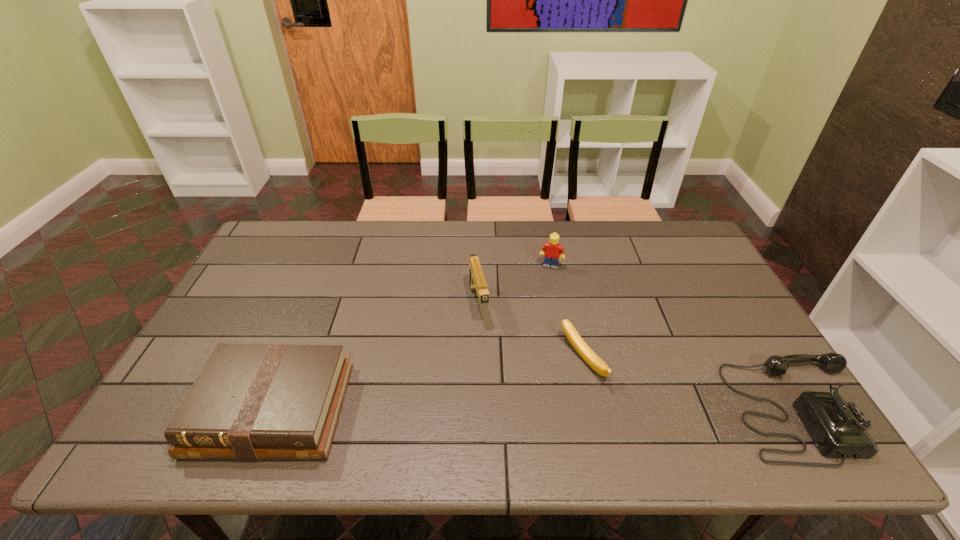
Locate an element on the screen. The width and height of the screenshot is (960, 540). vacant space positioned 0.140m at the barrel of the second farthest object is located at coordinates (491, 366).

Locate an element on the screen. The width and height of the screenshot is (960, 540). vacant point located at the barrel of the second farthest object is located at coordinates (502, 409).

Locate an element on the screen. vacant point located 0.150m at the barrel of the second farthest object is located at coordinates (492, 369).

The height and width of the screenshot is (540, 960). Find the location of `free space located on the front-facing side of the farthest object`. free space located on the front-facing side of the farthest object is located at coordinates (523, 360).

At what (x,y) coordinates should I click in order to perform the action: click on vacant space situated on the front-facing side of the farthest object. Please return your answer as a coordinate pair (x, y). The height and width of the screenshot is (540, 960). Looking at the image, I should click on (526, 352).

The height and width of the screenshot is (540, 960). Identify the location of free location located on the front-facing side of the farthest object. (526, 352).

Identify the location of Bible located at the near edge. Image resolution: width=960 pixels, height=540 pixels. (251, 401).

Locate an element on the screen. telephone at the near edge is located at coordinates (838, 428).

This screenshot has width=960, height=540. In order to click on banana at the near edge in this screenshot , I will do `click(589, 356)`.

Identify the location of object located at the left edge. Image resolution: width=960 pixels, height=540 pixels. (251, 401).